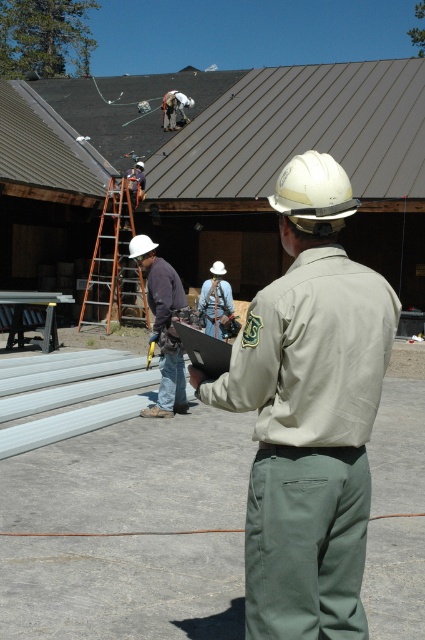
You are a drone operator trying to capture aerial footage of the construction site. You notice two points of interest marked as point 1 and point 2. Point 1 is at coordinates (x=331, y=292) and point 2 is at (x=226, y=320). Based on the scene description, which point is closer to your drone camera when flying overhead?

Point 1 at coordinates (x=331, y=292) is closer to the camera than point 2 at (x=226, y=320).